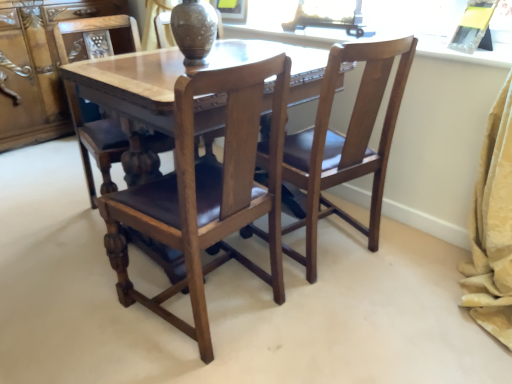
What are the coordinates of `vacant space that is to the left of polished wood chair at center, the 2th chair positioned from the left` in the screenshot? It's located at (79, 309).